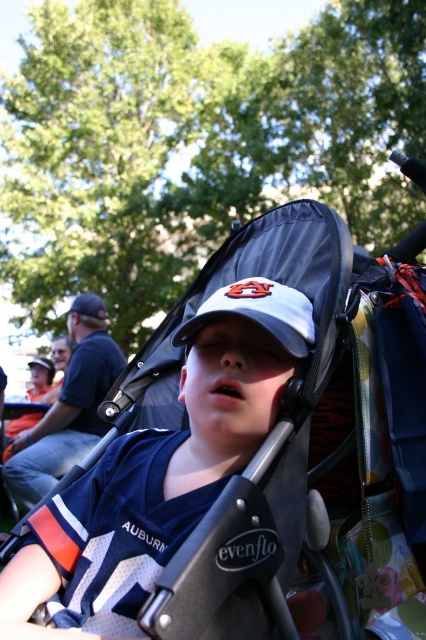
Question: Which point is farther to the camera?

Choices:
 (A) white matte baseball cap at center
 (B) gray matte baseball cap at center

Answer: (B)

Question: Is white matte baseball cap at center further to camera compared to gray matte baseball cap at center?

Choices:
 (A) yes
 (B) no

Answer: (B)

Question: Which of the following is the closest to the observer?

Choices:
 (A) (213, 305)
 (B) (299, 333)

Answer: (B)

Question: Does white matte baseball cap at center lie in front of gray matte baseball cap at center?

Choices:
 (A) no
 (B) yes

Answer: (B)

Question: Is white matte baseball cap at center smaller than gray matte baseball cap at center?

Choices:
 (A) no
 (B) yes

Answer: (A)